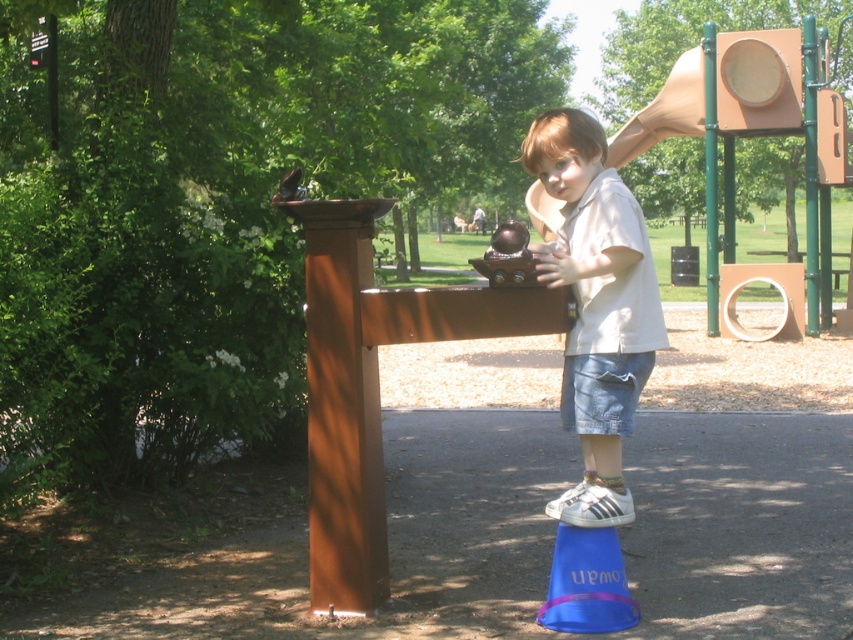
Question: Which is farther from the metallic brown toy at center?

Choices:
 (A) blue plastic cone at lower center
 (B) light beige cotton shirt at center

Answer: (A)

Question: Which point is closer to the camera taking this photo?

Choices:
 (A) (627, 317)
 (B) (577, 556)
 (C) (526, 243)

Answer: (A)

Question: Does light beige cotton shirt at center appear on the left side of blue plastic cone at lower center?

Choices:
 (A) no
 (B) yes

Answer: (B)

Question: Does light beige cotton shirt at center appear over blue plastic cone at lower center?

Choices:
 (A) yes
 (B) no

Answer: (A)

Question: Can you confirm if light beige cotton shirt at center is positioned to the left of metallic brown toy at center?

Choices:
 (A) yes
 (B) no

Answer: (B)

Question: Which point appears closest to the camera in this image?

Choices:
 (A) (529, 284)
 (B) (643, 337)

Answer: (B)